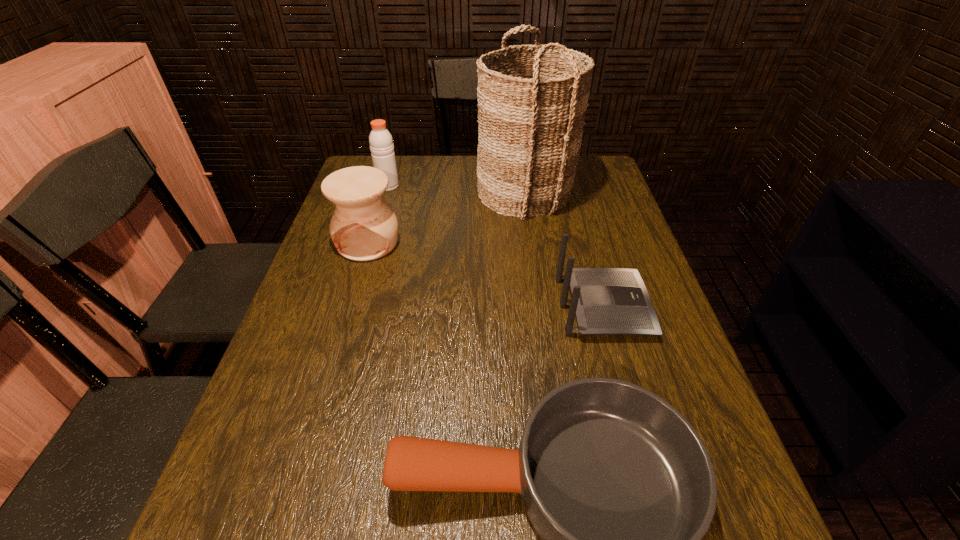
You are a GUI agent. You are given a task and a screenshot of the screen. Output one action in this format:
    pyautogui.click(x=<x>, y=<y>)
    Task: Click on the basket
    
    Given the screenshot: What is the action you would take?
    pyautogui.click(x=531, y=105)

Where is `shaker`? The image size is (960, 540). shaker is located at coordinates (381, 143).

Where is `the third nearest object`? The height and width of the screenshot is (540, 960). the third nearest object is located at coordinates coord(363,227).

Where is `the second nearest object`? The height and width of the screenshot is (540, 960). the second nearest object is located at coordinates (606, 301).

Find the location of a particular element. The height and width of the screenshot is (540, 960). router is located at coordinates (606, 301).

This screenshot has width=960, height=540. Find the location of `blank area located on the left of the tallest object`. blank area located on the left of the tallest object is located at coordinates (407, 192).

Where is `free region located 0.100m on the front of the shaker`? The image size is (960, 540). free region located 0.100m on the front of the shaker is located at coordinates (381, 210).

Locate an element on the screen. The width and height of the screenshot is (960, 540). free region located 0.080m at the open side of the pottery is located at coordinates (355, 284).

Locate an element on the screen. The image size is (960, 540). basket that is at the far edge is located at coordinates (531, 105).

The height and width of the screenshot is (540, 960). In order to click on shaker located in the far edge section of the desktop in this screenshot , I will do `click(381, 143)`.